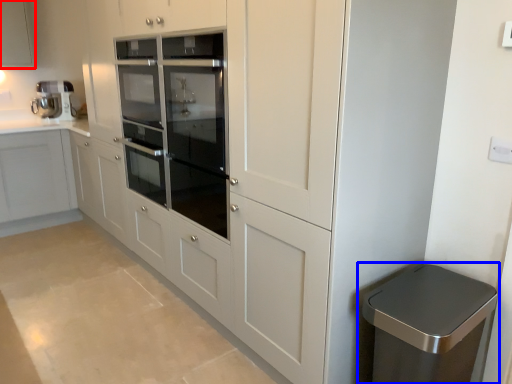
Question: Which of the following is the closest to the observer, cabinetry (highlighted by a red box) or waste container (highlighted by a blue box)?

Choices:
 (A) cabinetry
 (B) waste container

Answer: (B)